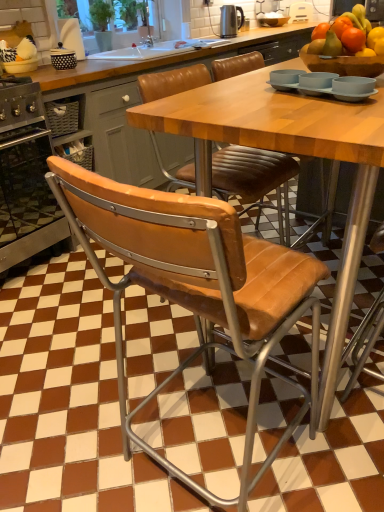
Question: From their relative heights in the image, would you say white plastic toaster at upper center, marked as the first appliance in a right-to-left arrangement, is taller or shorter than polished stainless steel kettle at upper center, arranged as the 2th appliance when viewed from the right?

Choices:
 (A) short
 (B) tall

Answer: (A)

Question: Would you say white plastic toaster at upper center, the second appliance in the front-to-back sequence, is to the left or to the right of polished stainless steel kettle at upper center, which is the second appliance from top to bottom, in the picture?

Choices:
 (A) right
 (B) left

Answer: (A)

Question: Which is nearer to the leather-like tan chair at center?

Choices:
 (A) stainless steel oven at left
 (B) white plastic toaster at upper center, the 1th appliance when ordered from top to bottom
 (C) polished stainless steel kettle at upper center, arranged as the 2th appliance when viewed from the right

Answer: (A)

Question: Which of these objects is positioned farthest from the stainless steel oven at left?

Choices:
 (A) leather-like tan chair at center
 (B) polished stainless steel kettle at upper center, marked as the 1th appliance in a front-to-back arrangement
 (C) white plastic toaster at upper center, which is counted as the 1th appliance, starting from the back

Answer: (C)